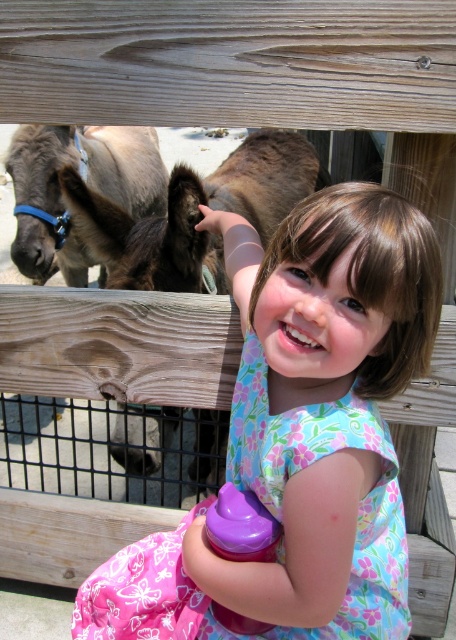
Measure the distance between brown fuzzy donkey at left and camera.

They are 4.20 feet apart.

Is brown fuzzy donkey at left wider than brown fuzzy donkey at upper left?

Yes.

Where is `brown fuzzy donkey at left`? The image size is (456, 640). brown fuzzy donkey at left is located at coordinates (196, 212).

Between floral fabric dress at center and brown fuzzy donkey at left, which one is positioned lower?

floral fabric dress at center is lower down.

Between point (217, 588) and point (161, 266), which one is positioned behind?

Positioned behind is point (161, 266).

The width and height of the screenshot is (456, 640). Identify the location of floral fabric dress at center. (300, 433).

Can you confirm if floral fabric dress at center is bigger than brown fuzzy donkey at upper left?

Incorrect, floral fabric dress at center is not larger than brown fuzzy donkey at upper left.

This screenshot has height=640, width=456. What do you see at coordinates (300, 433) in the screenshot? I see `floral fabric dress at center` at bounding box center [300, 433].

Describe the element at coordinates (300, 433) in the screenshot. I see `floral fabric dress at center` at that location.

I want to click on floral fabric dress at center, so click(x=300, y=433).